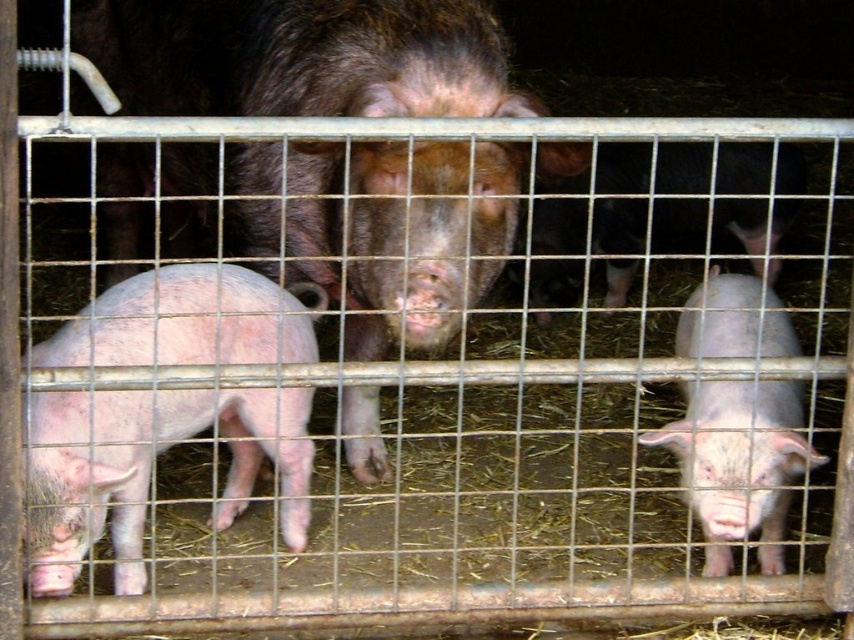
Question: Can you confirm if pink smooth pig at left is positioned above pink smooth piglet at right?

Choices:
 (A) yes
 (B) no

Answer: (B)

Question: Is brown matte pig at center further to camera compared to pink smooth piglet at right?

Choices:
 (A) yes
 (B) no

Answer: (B)

Question: Which object is closer to the camera taking this photo?

Choices:
 (A) pink smooth pig at left
 (B) pink smooth piglet at right

Answer: (A)

Question: Which of the following is the farthest from the observer?

Choices:
 (A) pos(416,22)
 (B) pos(227,413)

Answer: (B)

Question: Which point is farther to the camera?

Choices:
 (A) (45, 349)
 (B) (354, 317)

Answer: (B)

Question: Can you confirm if pink smooth pig at left is smaller than pink smooth piglet at right?

Choices:
 (A) yes
 (B) no

Answer: (A)